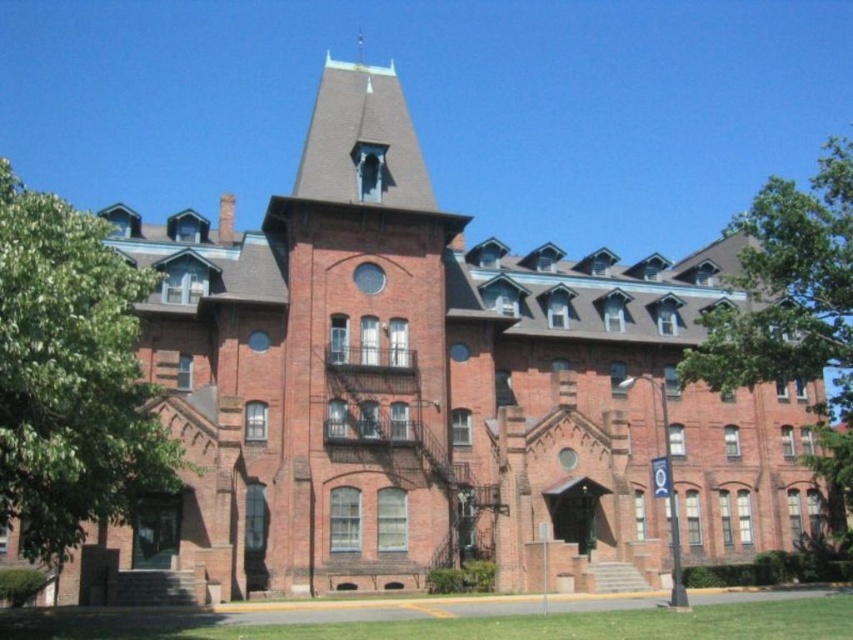
You are standing in front of the historic brick building and notice two green leafy trees. One is labeled as the green leafy tree at left and the other as the green leafy tree at right. Which tree is closer to the building?

The green leafy tree at left is positioned under green leafy tree at right, meaning the green leafy tree at left is closer to the building.